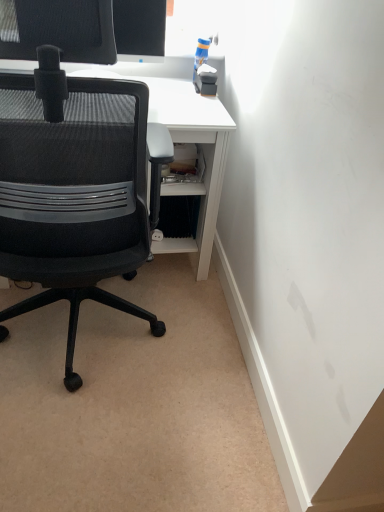
Locate an element on the screen. free spot below black mesh chair at left (from a real-world perspective) is located at coordinates (75, 332).